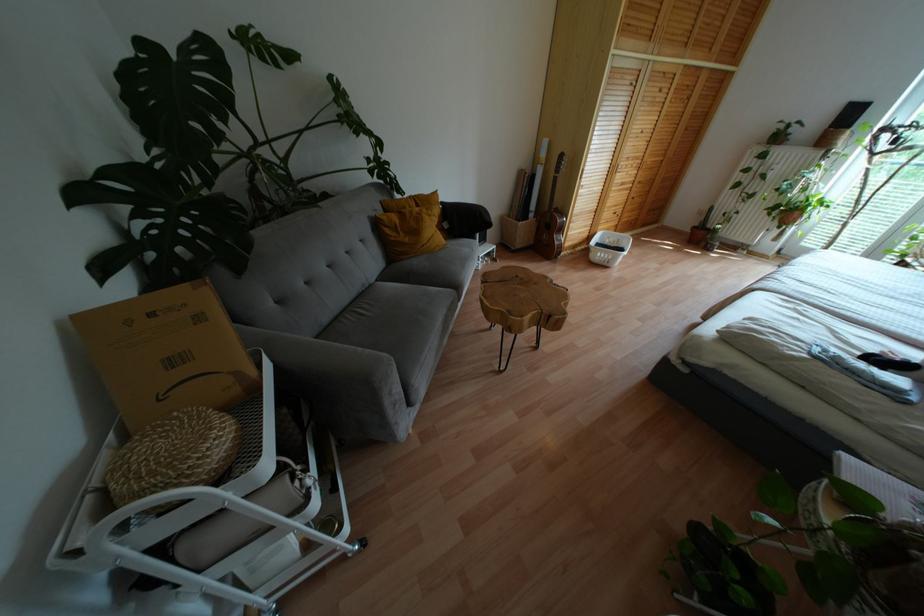
Image resolution: width=924 pixels, height=616 pixels. What do you see at coordinates (174, 456) in the screenshot? I see `the woven round lid` at bounding box center [174, 456].